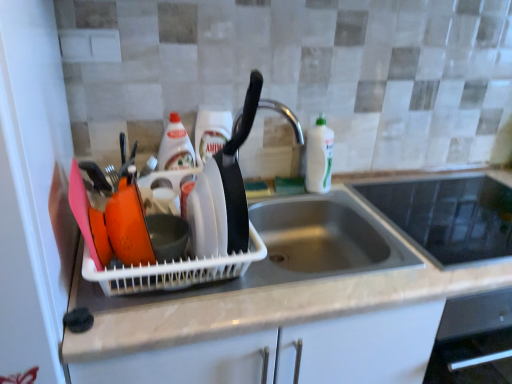
Locate an element on the screen. The image size is (512, 384). white matte countertop at center is located at coordinates (313, 292).

What do you see at coordinates (313, 292) in the screenshot? I see `white matte countertop at center` at bounding box center [313, 292].

In order to click on translucent plastic bottle at center, marked as the 1th bottle in a left-to-right arrangement in this screenshot , I will do `click(175, 147)`.

At what (x,y) coordinates should I click in order to perform the action: click on white glossy bottle at center, marked as the second bottle in a right-to-left arrangement. Please return your answer as a coordinate pair (x, y). The image size is (512, 384). Looking at the image, I should click on (211, 131).

I want to click on black glass cooktop at upper right, so click(x=448, y=216).

Find the location of a particular element. The height and width of the screenshot is (384, 512). white matte countertop at center is located at coordinates (313, 292).

Considering the relative positions of black glass cooktop at upper right and translucent plastic bottle at center, positioned as the third bottle in right-to-left order, in the image provided, is black glass cooktop at upper right to the left of translucent plastic bottle at center, positioned as the third bottle in right-to-left order, from the viewer's perspective?

In fact, black glass cooktop at upper right is to the right of translucent plastic bottle at center, positioned as the third bottle in right-to-left order.

Measure the distance from black glass cooktop at upper right to translucent plastic bottle at center, positioned as the third bottle in right-to-left order.

black glass cooktop at upper right and translucent plastic bottle at center, positioned as the third bottle in right-to-left order, are 28.97 inches apart.

Can you tell me how much black glass cooktop at upper right and translucent plastic bottle at center, positioned as the third bottle in right-to-left order, differ in facing direction?

They differ by 3.9 degrees in their facing directions.

From the image's perspective, who appears lower, black glass cooktop at upper right or translucent plastic bottle at center, marked as the 1th bottle in a left-to-right arrangement?

black glass cooktop at upper right.

Is white glossy bottle at sink right, the third bottle positioned from the left, oriented away from black glass cooktop at upper right?

white glossy bottle at sink right, the third bottle positioned from the left, is not turned away from black glass cooktop at upper right.

Considering the relative positions of white glossy bottle at sink right, which is the 1th bottle from right to left, and black glass cooktop at upper right in the image provided, is white glossy bottle at sink right, which is the 1th bottle from right to left, behind black glass cooktop at upper right?

Yes, white glossy bottle at sink right, which is the 1th bottle from right to left, is further from the camera.

Considering the sizes of objects white glossy bottle at sink right, the third bottle positioned from the left, and black glass cooktop at upper right in the image provided, who is bigger, white glossy bottle at sink right, the third bottle positioned from the left, or black glass cooktop at upper right?

With larger size is black glass cooktop at upper right.

From the image's perspective, would you say white glossy bottle at sink right, the third bottle positioned from the left, is positioned over black glass cooktop at upper right?

Yes, from the image's perspective, white glossy bottle at sink right, the third bottle positioned from the left, is on top of black glass cooktop at upper right.

Would you say white glossy bottle at center, the second bottle in the left-to-right sequence, is to the left or to the right of white glossy bottle at sink right, which is the 1th bottle from right to left, in the picture?

From the image, it's evident that white glossy bottle at center, the second bottle in the left-to-right sequence, is to the left of white glossy bottle at sink right, which is the 1th bottle from right to left.

Measure the distance between white glossy bottle at center, marked as the second bottle in a right-to-left arrangement, and white glossy bottle at sink right, which is the 1th bottle from right to left.

12.15 inches.

Which of these two, white glossy bottle at center, the second bottle in the left-to-right sequence, or white glossy bottle at sink right, the third bottle positioned from the left, is wider?

white glossy bottle at sink right, the third bottle positioned from the left.

From a real-world perspective, between white glossy bottle at center, the second bottle in the left-to-right sequence, and white glossy bottle at sink right, which is the 1th bottle from right to left, who is vertically higher?

From a 3D spatial view, white glossy bottle at center, the second bottle in the left-to-right sequence, is above.

From a real-world perspective, is white matte countertop at center physically below white glossy bottle at sink right, the third bottle positioned from the left?

Yes, from a real-world perspective, white matte countertop at center is below white glossy bottle at sink right, the third bottle positioned from the left.

Between point (119, 349) and point (317, 146), which one is positioned behind?

The point (317, 146) is more distant.

Does white matte countertop at center come in front of white glossy bottle at sink right, which is the 1th bottle from right to left?

Yes, white matte countertop at center is in front of white glossy bottle at sink right, which is the 1th bottle from right to left.

Could you measure the distance between white matte countertop at center and white glossy bottle at sink right, the third bottle positioned from the left?

15.29 inches.

Is translucent plastic bottle at center, positioned as the third bottle in right-to-left order, not close to white matte countertop at center?

No, there isn't a large distance between translucent plastic bottle at center, positioned as the third bottle in right-to-left order, and white matte countertop at center.

Could you tell me if translucent plastic bottle at center, marked as the 1th bottle in a left-to-right arrangement, is facing white matte countertop at center?

No, translucent plastic bottle at center, marked as the 1th bottle in a left-to-right arrangement, is not aimed at white matte countertop at center.

From the picture: From a real-world perspective, relative to white matte countertop at center, is translucent plastic bottle at center, positioned as the third bottle in right-to-left order, vertically above or below?

In terms of real-world spatial position, translucent plastic bottle at center, positioned as the third bottle in right-to-left order, is above white matte countertop at center.

Consider the image. How far apart are translucent plastic bottle at center, marked as the 1th bottle in a left-to-right arrangement, and white matte countertop at center?

translucent plastic bottle at center, marked as the 1th bottle in a left-to-right arrangement, and white matte countertop at center are 20.22 inches apart from each other.

From a real-world perspective, does black glass cooktop at upper right stand above white glossy bottle at center, marked as the second bottle in a right-to-left arrangement?

Actually, black glass cooktop at upper right is physically below white glossy bottle at center, marked as the second bottle in a right-to-left arrangement, in the real world.

Identify the location of appliance below the white glossy bottle at center, marked as the second bottle in a right-to-left arrangement (from the image's perspective). The height and width of the screenshot is (384, 512). (448, 216).

Between black glass cooktop at upper right and white glossy bottle at center, marked as the second bottle in a right-to-left arrangement, which one has larger width?

black glass cooktop at upper right is wider.

From the image's perspective, does black glass cooktop at upper right appear lower than white glossy bottle at center, marked as the second bottle in a right-to-left arrangement?

Yes.

Which is closer to the camera, [318,174] or [187,133]?

Point [318,174] appears to be farther away from the viewer than point [187,133].

Is white glossy bottle at sink right, the third bottle positioned from the left, next to translucent plastic bottle at center, positioned as the third bottle in right-to-left order, and touching it?

No, white glossy bottle at sink right, the third bottle positioned from the left, is not beside translucent plastic bottle at center, positioned as the third bottle in right-to-left order.

Is white glossy bottle at sink right, which is the 1th bottle from right to left, facing towards translucent plastic bottle at center, marked as the 1th bottle in a left-to-right arrangement?

No, white glossy bottle at sink right, which is the 1th bottle from right to left, does not turn towards translucent plastic bottle at center, marked as the 1th bottle in a left-to-right arrangement.

Between white glossy bottle at sink right, the third bottle positioned from the left, and translucent plastic bottle at center, positioned as the third bottle in right-to-left order, which one appears on the left side from the viewer's perspective?

translucent plastic bottle at center, positioned as the third bottle in right-to-left order, is more to the left.

At what (x,y) coordinates should I click in order to perform the action: click on appliance that is under the translucent plastic bottle at center, marked as the 1th bottle in a left-to-right arrangement (from a real-world perspective). Please return your answer as a coordinate pair (x, y). Looking at the image, I should click on (448, 216).

You are a GUI agent. You are given a task and a screenshot of the screen. Output one action in this format:
    pyautogui.click(x=<x>, y=<y>)
    Task: Click on the bottle that is the 3rd one when counting upward from the black glass cooktop at upper right (from the image's perspective)
    The width and height of the screenshot is (512, 384).
    Given the screenshot: What is the action you would take?
    pyautogui.click(x=319, y=157)

From the image, which object appears to be nearer to white glossy bottle at center, the second bottle in the left-to-right sequence, translucent plastic bottle at center, marked as the 1th bottle in a left-to-right arrangement, or white matte countertop at center?

translucent plastic bottle at center, marked as the 1th bottle in a left-to-right arrangement, is closer to white glossy bottle at center, the second bottle in the left-to-right sequence.

In the scene shown: Considering their positions, is black glass cooktop at upper right positioned closer to white matte countertop at center than white glossy bottle at center, the second bottle in the left-to-right sequence?

black glass cooktop at upper right is positioned closer to the anchor white matte countertop at center.

Considering their positions, is white matte countertop at center positioned further to white glossy bottle at sink right, which is the 1th bottle from right to left, than white glossy bottle at center, marked as the second bottle in a right-to-left arrangement?

white matte countertop at center.

Which object lies further to the anchor point white glossy bottle at center, marked as the second bottle in a right-to-left arrangement, black glass cooktop at upper right or white glossy bottle at sink right, the third bottle positioned from the left?

black glass cooktop at upper right is positioned further to the anchor white glossy bottle at center, marked as the second bottle in a right-to-left arrangement.

Estimate the real-world distances between objects in this image. Which object is further from white matte countertop at center, white glossy bottle at center, marked as the second bottle in a right-to-left arrangement, or translucent plastic bottle at center, marked as the 1th bottle in a left-to-right arrangement?

Among the two, translucent plastic bottle at center, marked as the 1th bottle in a left-to-right arrangement, is located further to white matte countertop at center.

Which object lies nearer to the anchor point white matte countertop at center, black glass cooktop at upper right or white glossy bottle at sink right, which is the 1th bottle from right to left?

black glass cooktop at upper right is positioned closer to the anchor white matte countertop at center.

From the image, which object appears to be nearer to white matte countertop at center, white glossy bottle at sink right, which is the 1th bottle from right to left, or translucent plastic bottle at center, marked as the 1th bottle in a left-to-right arrangement?

The object closer to white matte countertop at center is white glossy bottle at sink right, which is the 1th bottle from right to left.

Consider the image. Looking at the image, which one is located further to black glass cooktop at upper right, white glossy bottle at sink right, the third bottle positioned from the left, or white matte countertop at center?

Among the two, white glossy bottle at sink right, the third bottle positioned from the left, is located further to black glass cooktop at upper right.

This screenshot has width=512, height=384. Identify the location of bottle between white glossy bottle at center, the second bottle in the left-to-right sequence, and black glass cooktop at upper right from left to right. (319, 157).

You are a GUI agent. You are given a task and a screenshot of the screen. Output one action in this format:
    pyautogui.click(x=<x>, y=<y>)
    Task: Click on the countertop between translucent plastic bottle at center, positioned as the third bottle in right-to-left order, and black glass cooktop at upper right
    The height and width of the screenshot is (384, 512).
    Given the screenshot: What is the action you would take?
    (313, 292)

Identify the location of bottle situated between translucent plastic bottle at center, marked as the 1th bottle in a left-to-right arrangement, and white glossy bottle at sink right, the third bottle positioned from the left, from left to right. This screenshot has width=512, height=384. (211, 131).

Identify the location of countertop between white glossy bottle at center, the second bottle in the left-to-right sequence, and black glass cooktop at upper right, in the horizontal direction. The image size is (512, 384). (313, 292).